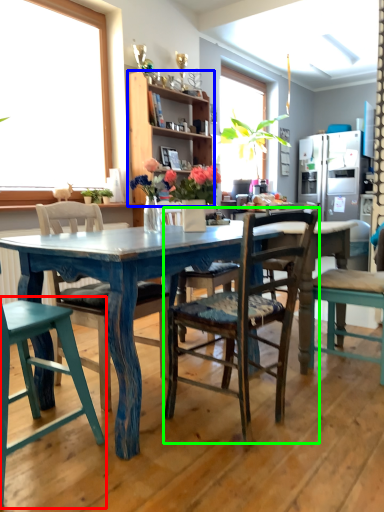
Question: Based on their relative distances, which object is nearer to chair (highlighted by a red box)? Choose from cabinetry (highlighted by a blue box) and chair (highlighted by a green box).

Choices:
 (A) cabinetry
 (B) chair

Answer: (B)